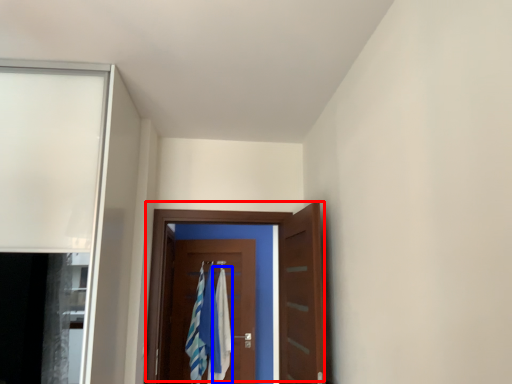
Question: Among these objects, which one is farthest to the camera, door (highlighted by a red box) or bath towel (highlighted by a blue box)?

Choices:
 (A) door
 (B) bath towel

Answer: (B)